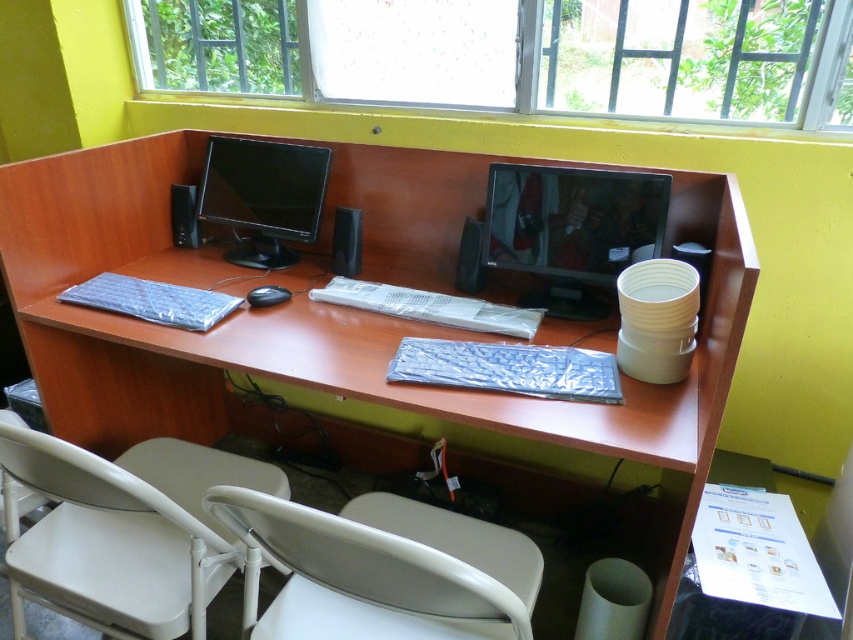
Question: Which of these objects is positioned farthest from the white plastic swivel chair at lower center?

Choices:
 (A) brown wood computer desk at center
 (B) black matte mouse at center
 (C) matte black monitor at upper left

Answer: (C)

Question: Which of the following is the closest to the observer?

Choices:
 (A) white plastic swivel chair at lower center
 (B) white plastic swivel chair at lower left

Answer: (A)

Question: Where is white plastic swivel chair at lower center located in relation to matte black monitor at upper left in the image?

Choices:
 (A) left
 (B) right

Answer: (B)

Question: Can you confirm if white plastic swivel chair at lower center is positioned below black matte mouse at center?

Choices:
 (A) yes
 (B) no

Answer: (A)

Question: Considering the real-world distances, which object is closest to the transparent glass window at upper center?

Choices:
 (A) brown wood computer desk at center
 (B) matte black monitor at upper left

Answer: (B)

Question: Is transparent glass window at upper center above white plastic swivel chair at lower center?

Choices:
 (A) no
 (B) yes

Answer: (B)